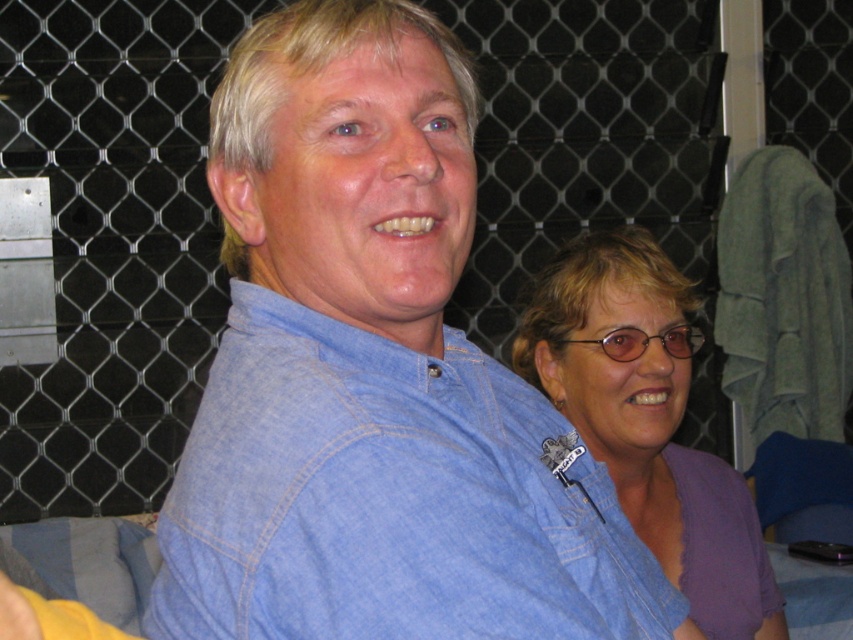
Question: Which point appears closest to the camera in this image?

Choices:
 (A) (589, 435)
 (B) (293, 602)

Answer: (B)

Question: Can you confirm if denim shirt at upper center is wider than purple cotton shirt at right?

Choices:
 (A) yes
 (B) no

Answer: (A)

Question: Is denim shirt at upper center closer to camera compared to purple cotton shirt at right?

Choices:
 (A) yes
 (B) no

Answer: (A)

Question: Which object is farther from the camera taking this photo?

Choices:
 (A) purple cotton shirt at right
 (B) denim shirt at upper center

Answer: (A)

Question: Which point is closer to the camera?

Choices:
 (A) (498, 403)
 (B) (616, 284)

Answer: (A)

Question: Is denim shirt at upper center above purple cotton shirt at right?

Choices:
 (A) no
 (B) yes

Answer: (A)